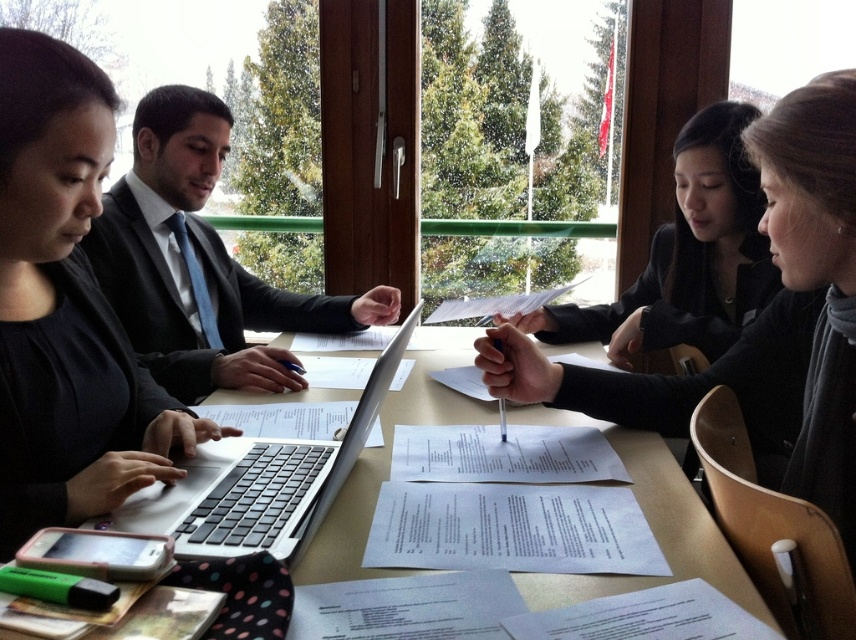
Question: Which point appears farthest from the camera in this image?

Choices:
 (A) (352, 452)
 (B) (681, 563)

Answer: (A)

Question: Can you confirm if silver/black matte laptop at center is positioned above matte silver laptop at center?

Choices:
 (A) yes
 (B) no

Answer: (A)

Question: Can you confirm if matte black suit at center is positioned below black matte jacket at upper right?

Choices:
 (A) yes
 (B) no

Answer: (B)

Question: Based on their relative distances, which object is farther from the silver/black matte laptop at center?

Choices:
 (A) matte silver laptop at center
 (B) matte black laptop at left

Answer: (B)

Question: Considering the real-world distances, which object is farthest from the matte silver laptop at center?

Choices:
 (A) black matte jacket at upper right
 (B) silver/black matte laptop at center
 (C) matte black laptop at left
 (D) matte black suit at center

Answer: (D)

Question: Is matte black laptop at left in front of matte black suit at center?

Choices:
 (A) no
 (B) yes

Answer: (B)